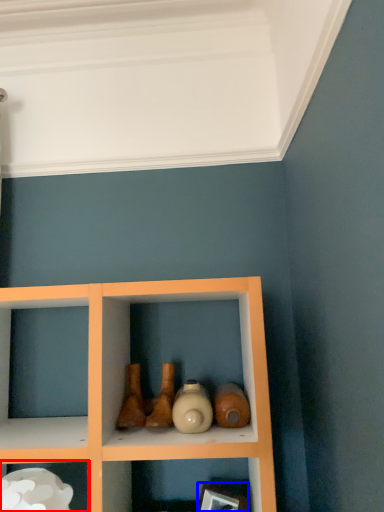
Question: Among these objects, which one is farthest to the camera, shelf (highlighted by a red box) or picture frame (highlighted by a blue box)?

Choices:
 (A) shelf
 (B) picture frame

Answer: (B)